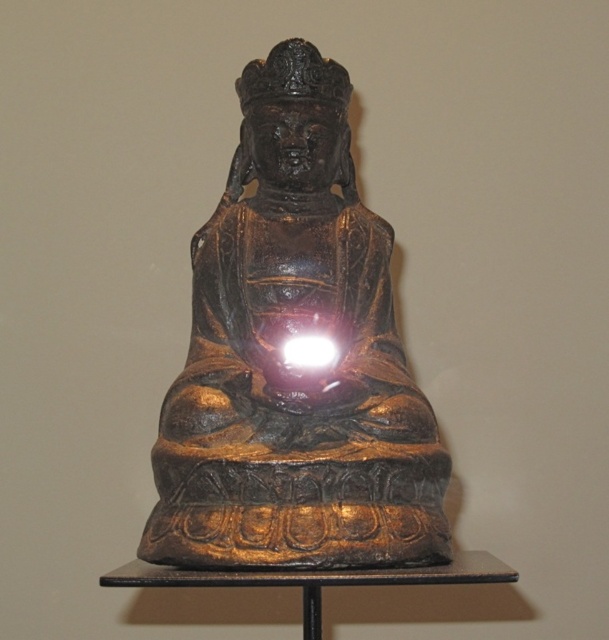
Question: Is gold-bronze statue at center wider than bright white light at center?

Choices:
 (A) no
 (B) yes

Answer: (B)

Question: Which of the following is the closest to the observer?

Choices:
 (A) bright white light at center
 (B) gold-bronze statue at center

Answer: (B)

Question: Does gold-bronze statue at center appear under bright white light at center?

Choices:
 (A) no
 (B) yes

Answer: (A)

Question: Among these objects, which one is nearest to the camera?

Choices:
 (A) bright white light at center
 (B) gold-bronze statue at center

Answer: (B)

Question: Can you confirm if gold-bronze statue at center is positioned to the left of bright white light at center?

Choices:
 (A) no
 (B) yes

Answer: (B)